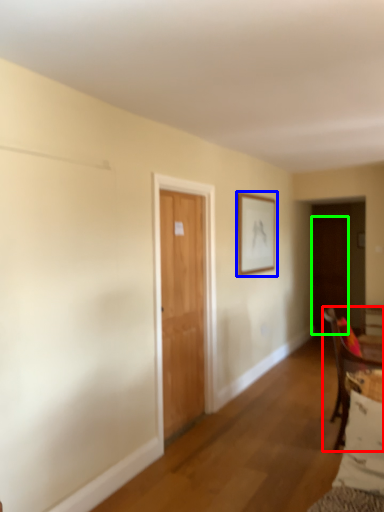
Question: Which is nearer to the chair (highlighted by a red box)? picture frame (highlighted by a blue box) or door (highlighted by a green box).

Choices:
 (A) picture frame
 (B) door

Answer: (A)